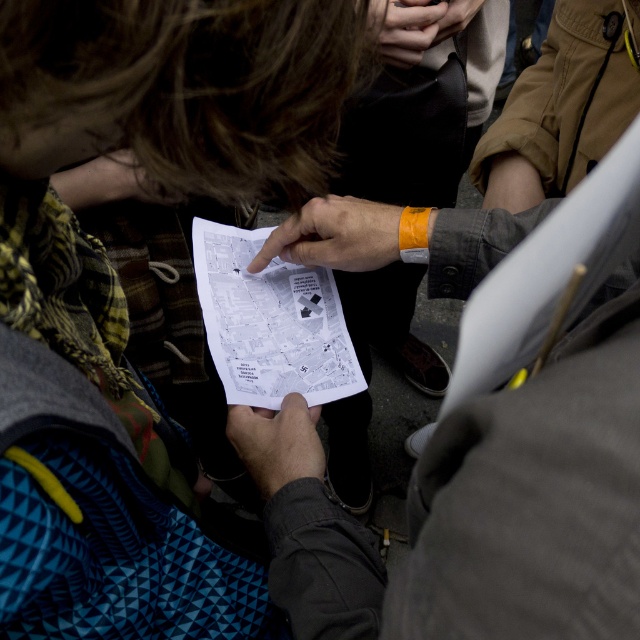
Can you confirm if white paper at center is wider than smooth skin hand at upper center?

Yes.

Find the location of a particular element. white paper at center is located at coordinates (269, 323).

Identify the location of white paper at center. Image resolution: width=640 pixels, height=640 pixels. (269, 323).

Based on the photo, does smooth black paper at center have a smaller size compared to dark brown leather hand at center?

Yes, smooth black paper at center is smaller than dark brown leather hand at center.

Between point (298, 461) and point (108, 184), which one is positioned behind?

The point (108, 184) is more distant.

The height and width of the screenshot is (640, 640). Find the location of `smooth black paper at center`. smooth black paper at center is located at coordinates (276, 442).

Who is taller, plaid fabric scarf at upper left or dark brown leather hand at center?

plaid fabric scarf at upper left is taller.

Can you confirm if plaid fabric scarf at upper left is positioned above dark brown leather hand at center?

No, plaid fabric scarf at upper left is not above dark brown leather hand at center.

I want to click on plaid fabric scarf at upper left, so click(150, 145).